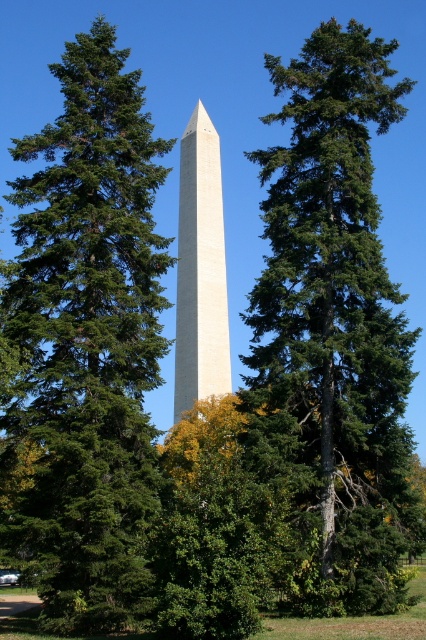
Between green evergreen tree at center and green textured tree at center, which one appears on the right side from the viewer's perspective?

Positioned to the right is green textured tree at center.

Can you confirm if green evergreen tree at center is taller than green textured tree at center?

In fact, green evergreen tree at center may be shorter than green textured tree at center.

Is point (17, 413) in front of point (284, 232)?

That is True.

Identify the location of green evergreen tree at center. (86, 342).

Which is behind, point (66, 508) or point (187, 355)?

Positioned behind is point (187, 355).

Describe the element at coordinates (86, 342) in the screenshot. The image size is (426, 640). I see `green evergreen tree at center` at that location.

The image size is (426, 640). What do you see at coordinates (86, 342) in the screenshot? I see `green evergreen tree at center` at bounding box center [86, 342].

The width and height of the screenshot is (426, 640). What are the coordinates of `green evergreen tree at center` in the screenshot? It's located at (86, 342).

Does point (377, 408) come behind point (181, 272)?

No, it is not.

Identify the location of green textured tree at center. (336, 317).

Locate an element on the screen. Image resolution: width=426 pixels, height=640 pixels. green textured tree at center is located at coordinates (336, 317).